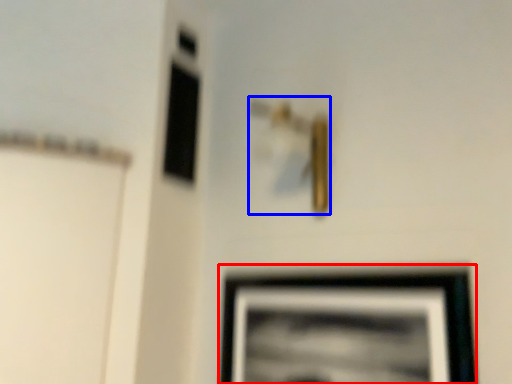
Question: Which point is closer to the camera, picture frame (highlighted by a red box) or door handle (highlighted by a blue box)?

Choices:
 (A) picture frame
 (B) door handle

Answer: (A)